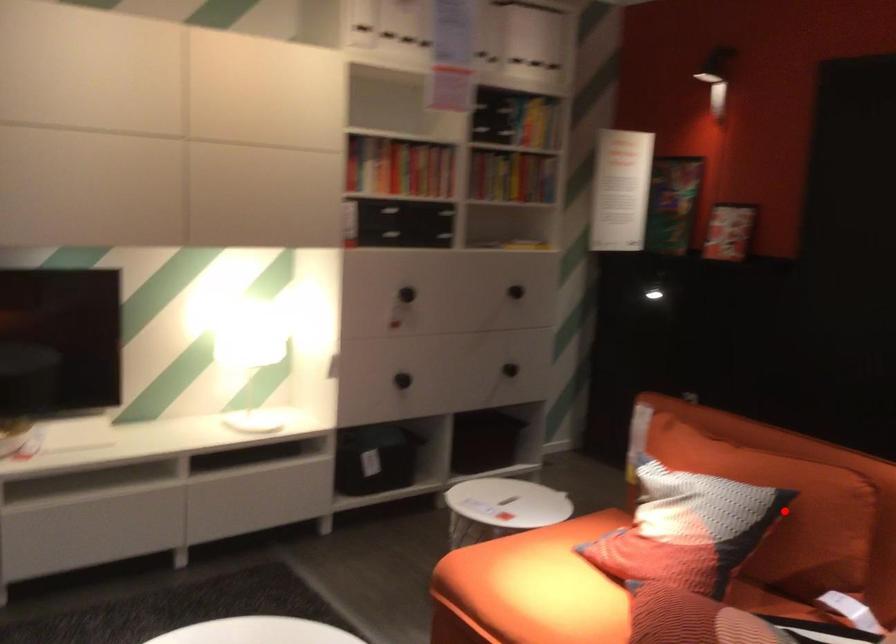
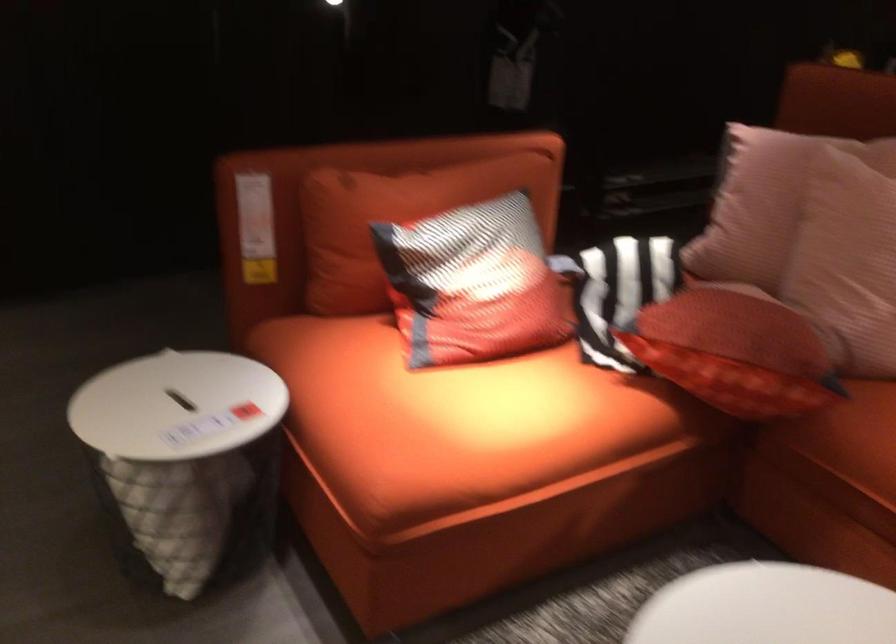
Question: I am providing you with two images of the same scene from different viewpoints. A red point is marked on the first image. Can you still see the location of the red point in image 2?

Choices:
 (A) Yes
 (B) No

Answer: (B)